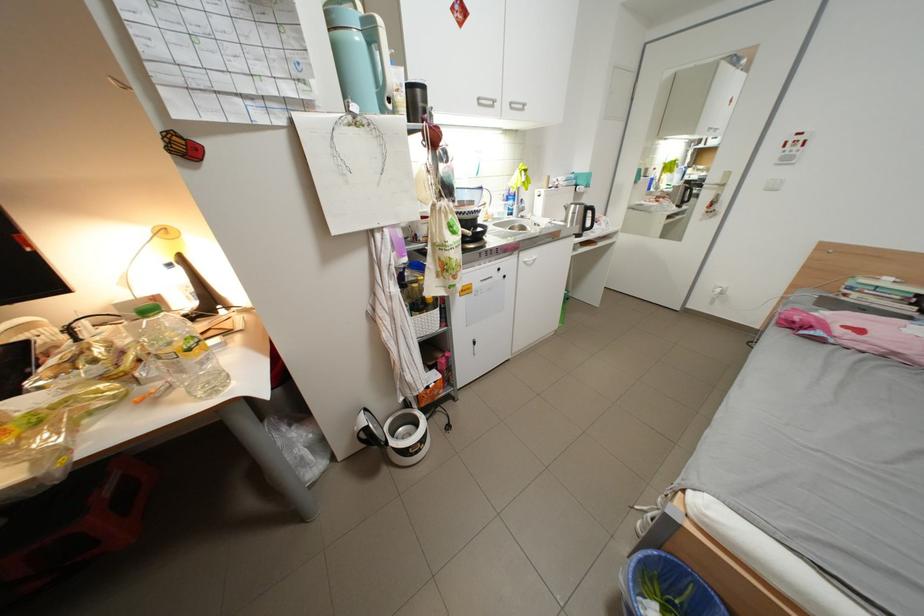
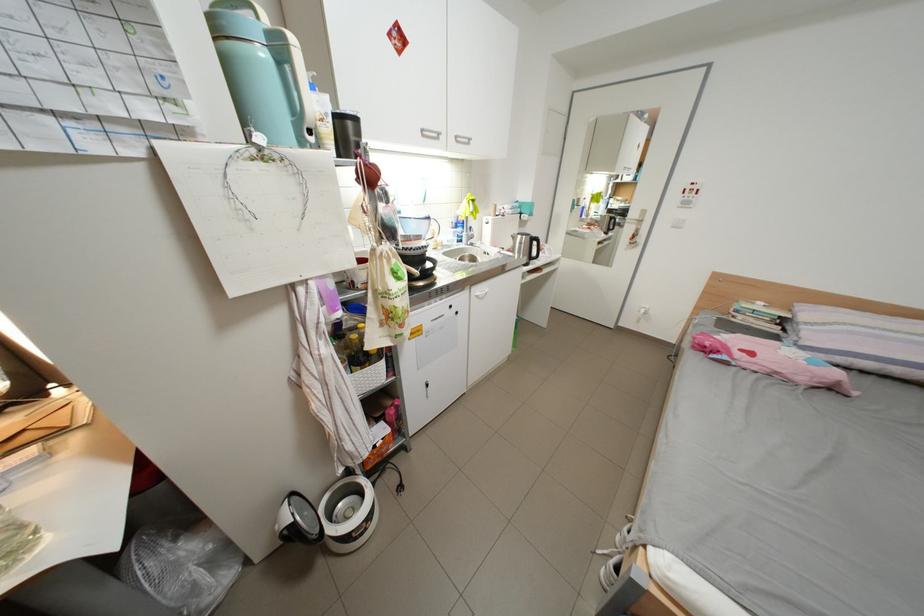
Question: How did the camera likely rotate?

Choices:
 (A) Left
 (B) Right
 (C) Up
 (D) Down

Answer: (B)